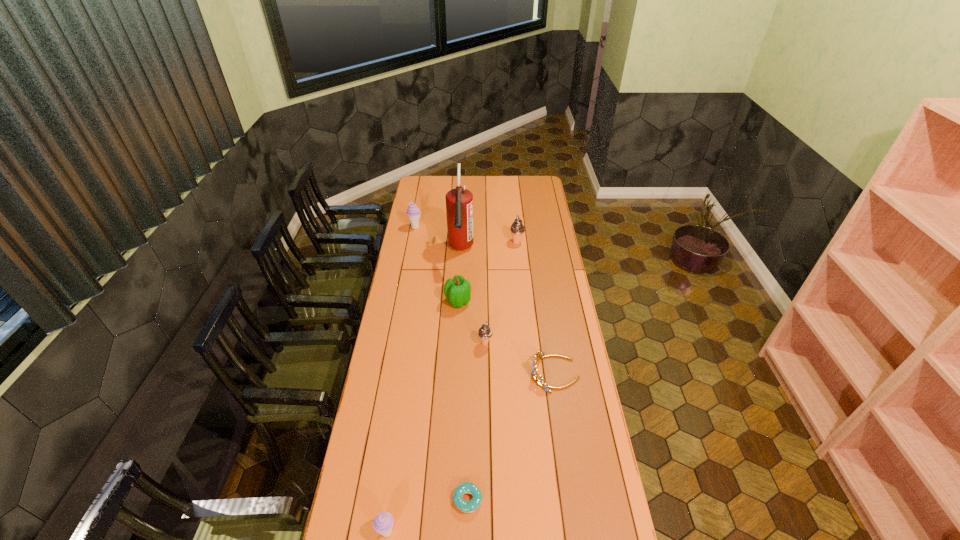
Identify the location of vacant space in between the leftmost icecream and the fifth nearest object. (437, 264).

Where is `free space between the right chocolate icecream and the sixth farthest object`? The height and width of the screenshot is (540, 960). free space between the right chocolate icecream and the sixth farthest object is located at coordinates (536, 308).

At what (x,y) coordinates should I click in order to perform the action: click on empty space that is in between the gold tiara and the red fire extinguisher. Please return your answer as a coordinate pair (x, y). This screenshot has width=960, height=540. Looking at the image, I should click on pyautogui.click(x=508, y=312).

This screenshot has height=540, width=960. Find the location of `vacant area that lies between the left purple icecream and the fourth farthest object`. vacant area that lies between the left purple icecream and the fourth farthest object is located at coordinates (437, 264).

Locate which object is the third closest to the shortest object. Please provide its 2D coordinates. Your answer should be formatted as a tuple, i.e. [(x, y)], where the tuple contains the x and y coordinates of a point satisfying the conditions above.

[(485, 332)]

Locate an element on the screen. object that stands as the second closest to the farthest icecream is located at coordinates (517, 228).

Where is `icecream identified as the fourth closest to the green bell pepper`? icecream identified as the fourth closest to the green bell pepper is located at coordinates (383, 523).

Identify which icecream is the closest to the green bell pepper. Please provide its 2D coordinates. Your answer should be formatted as a tuple, i.e. [(x, y)], where the tuple contains the x and y coordinates of a point satisfying the conditions above.

[(485, 332)]

Locate an element on the screen. This screenshot has width=960, height=540. free spot that satisfies the following two spatial constraints: 1. on the front side of the smaller chocolate icecream; 2. on the left side of the farthest icecream is located at coordinates (394, 343).